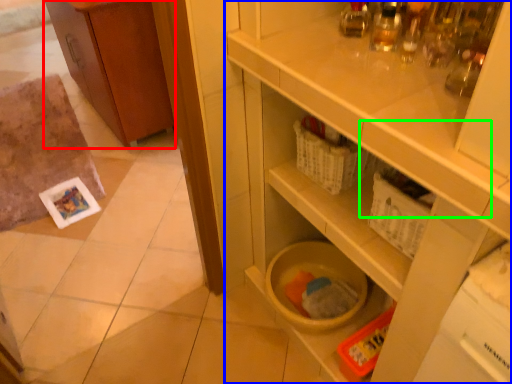
Question: Which is farther away from cabinetry (highlighted by a red box)? cupboard (highlighted by a blue box) or drawer (highlighted by a green box)?

Choices:
 (A) cupboard
 (B) drawer

Answer: (B)